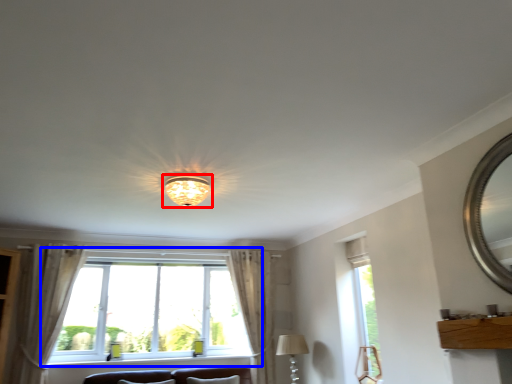
Question: Which object appears farthest to the camera in this image, lamp (highlighted by a red box) or window (highlighted by a blue box)?

Choices:
 (A) lamp
 (B) window

Answer: (B)